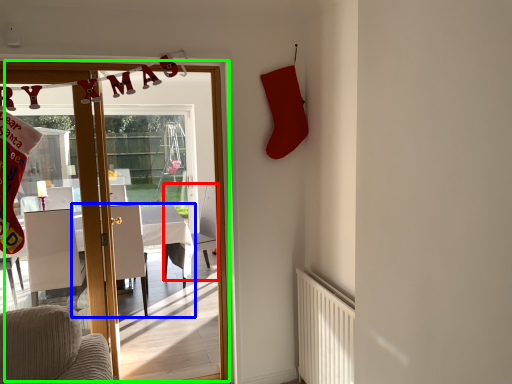
Question: Estimate the real-world distances between objects in this image. Which object is farther from armchair (highlighted by a red box), table (highlighted by a blue box) or door (highlighted by a green box)?

Choices:
 (A) table
 (B) door

Answer: (B)